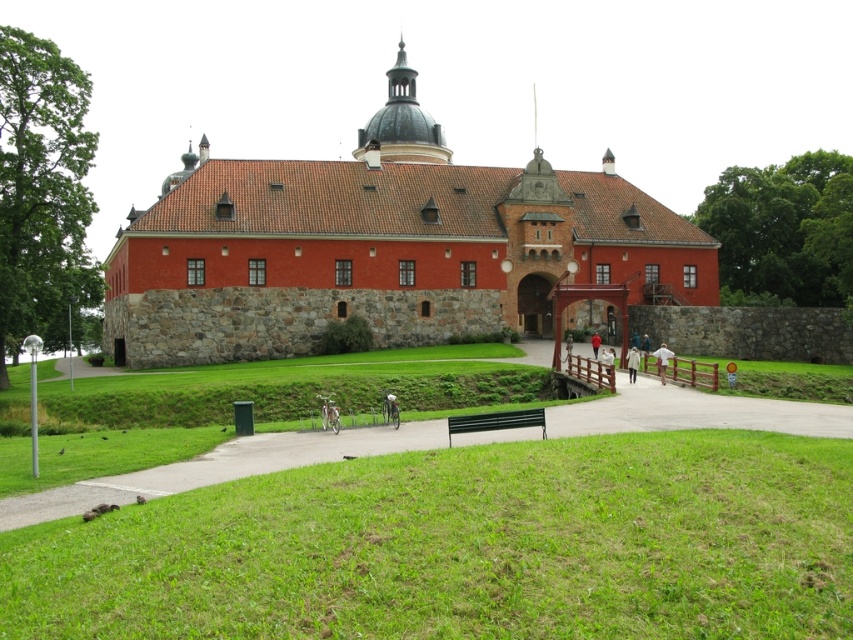
You are standing in the courtyard of the historic building and see the green grass at lower center and the black plastic bench at lower center. Which object is closer to the ground?

The green grass at lower center is located below the black plastic bench at lower center, so it is closer to the ground.

You are standing at the center of the image and want to place a small garden ornament. The ornament requires a specific coordinate to be placed on the green grass at lower center. What are the coordinates where you should place it?

The coordinates for placing the garden ornament on the green grass at lower center are at point (467, 545).